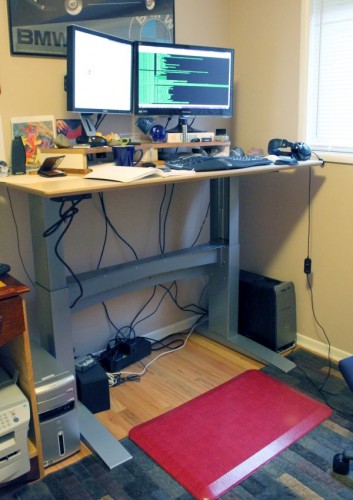
Identify the location of blue and tan striped carpet. (158, 484).